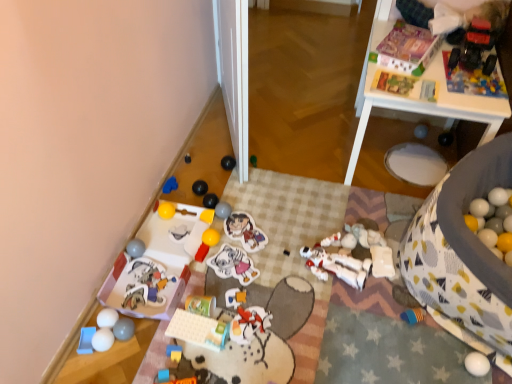
The image size is (512, 384). Identify the location of free point behind white matte plush at center, which ranks as the 23th toy in left-to-right order. (370, 232).